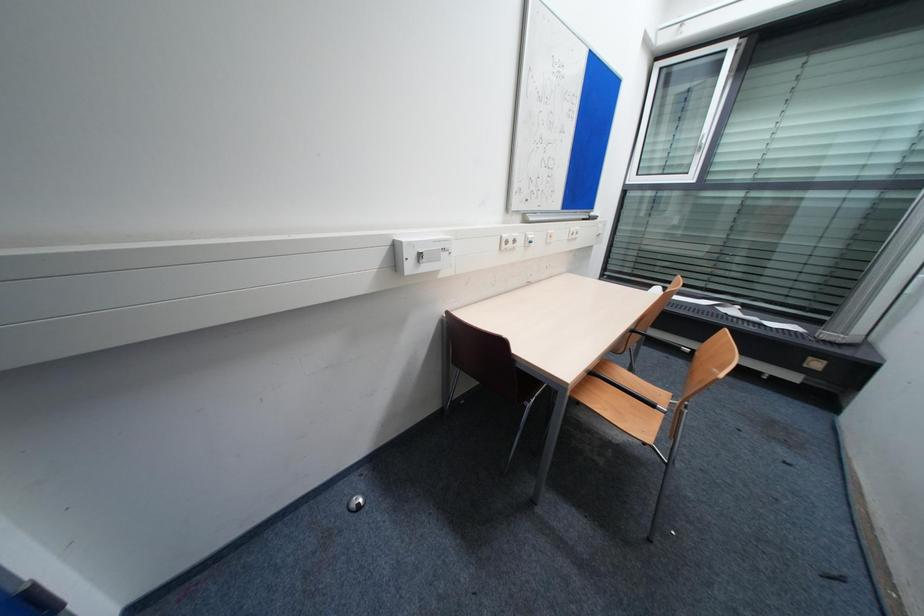
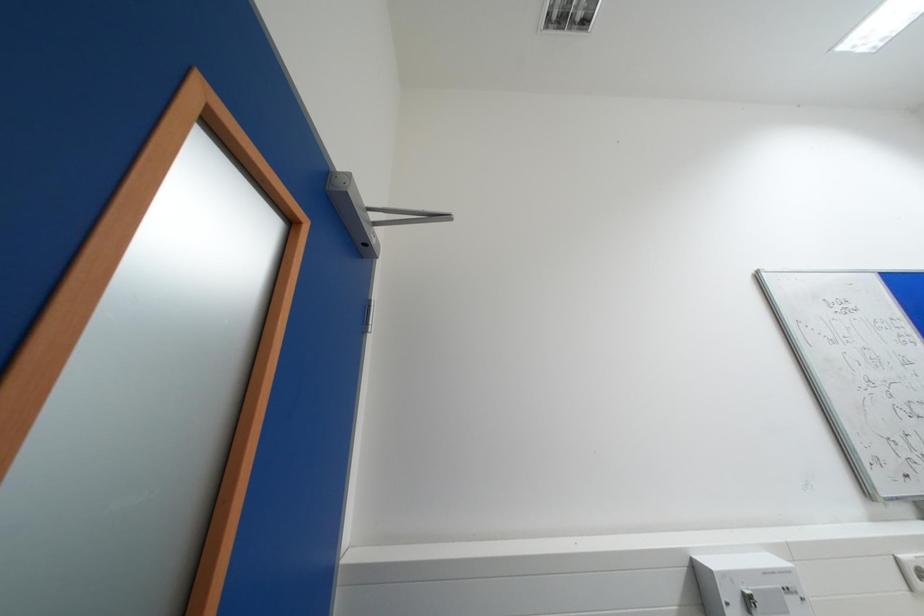
How did the camera likely rotate?

The camera's rotation is toward left-up.